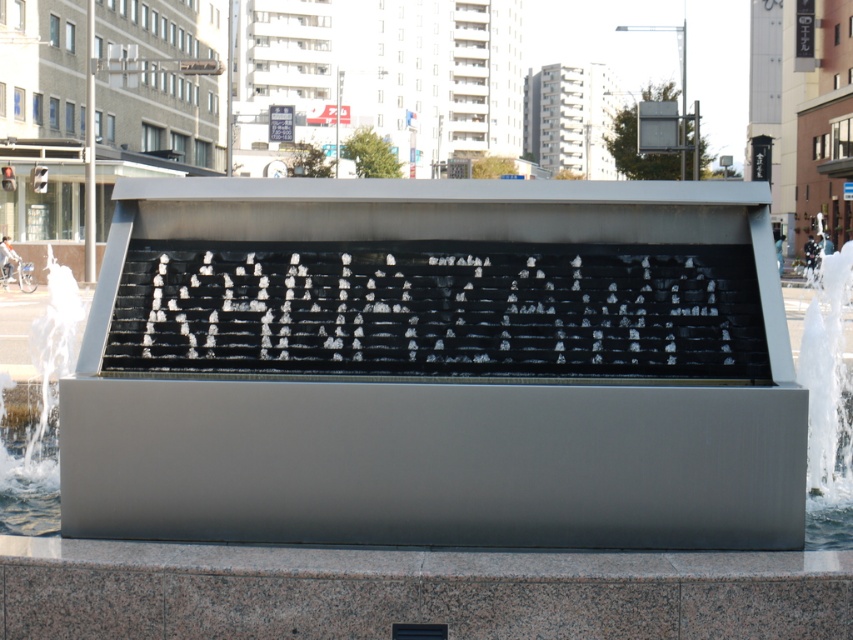
Does satin silver fountain at center appear on the left side of clear water at fountain left?

No, satin silver fountain at center is not to the left of clear water at fountain left.

At what (x,y) coordinates should I click in order to perform the action: click on satin silver fountain at center. Please return your answer as a coordinate pair (x, y). The width and height of the screenshot is (853, 640). Looking at the image, I should click on (436, 365).